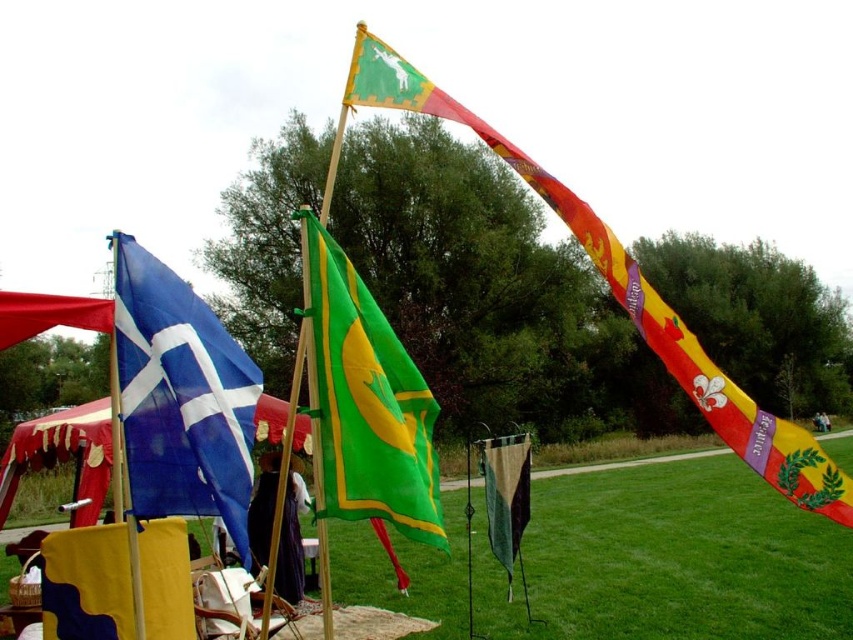
You are a photographer setting up a tripod to capture the flags in the scene. The green matte flag at center and the camouflage fabric flag at center are both in your viewfinder. Which flag should you focus on if you want to capture the one that is higher up in the frame?

The green matte flag at center is above the camouflage fabric flag at center, so you should focus on the green matte flag at center to capture the higher one.

You are standing in the park and see two green flags. The first is the green matte flag at center, and the second is the green fabric flag at upper center. Which flag is positioned to the left of the other?

The green matte flag at center is positioned to the left of the green fabric flag at upper center.